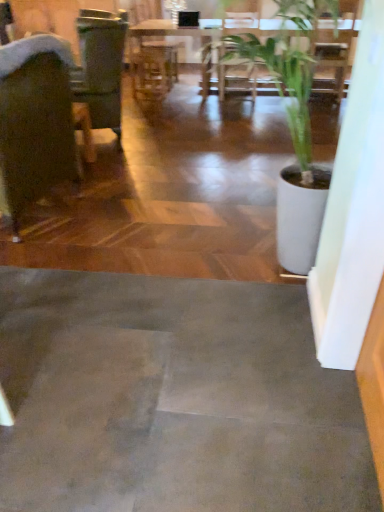
Where is `green leafy plant at upper center`? This screenshot has height=512, width=384. green leafy plant at upper center is located at coordinates (333, 57).

This screenshot has height=512, width=384. What do you see at coordinates (333, 57) in the screenshot? I see `green leafy plant at upper center` at bounding box center [333, 57].

What is the approximate height of dark brown leather chair at left?

3.51 feet.

What are the coordinates of `dark brown leather chair at left` in the screenshot? It's located at (35, 122).

Measure the distance between point [27,39] and camera.

A distance of 6.73 feet exists between point [27,39] and camera.

What do you see at coordinates (35, 122) in the screenshot? I see `dark brown leather chair at left` at bounding box center [35, 122].

Where is `green leafy plant at upper center`? The width and height of the screenshot is (384, 512). green leafy plant at upper center is located at coordinates (333, 57).

Considering the positions of objects green leafy plant at upper center and dark brown leather chair at left in the image provided, who is more to the left, green leafy plant at upper center or dark brown leather chair at left?

Positioned to the left is dark brown leather chair at left.

Consider the image. Which is behind, green leafy plant at upper center or dark brown leather chair at left?

green leafy plant at upper center.

Is point (342, 46) positioned after point (14, 119)?

Yes, point (342, 46) is farther from viewer.

From the image's perspective, is green leafy plant at upper center located above or below dark brown leather chair at left?

Based on their image positions, green leafy plant at upper center is located above dark brown leather chair at left.

From a real-world perspective, who is located higher, green leafy plant at upper center or dark brown leather chair at left?

dark brown leather chair at left.

Considering the relative sizes of green leafy plant at upper center and dark brown leather chair at left in the image provided, is green leafy plant at upper center wider than dark brown leather chair at left?

Correct, the width of green leafy plant at upper center exceeds that of dark brown leather chair at left.

Based on the photo, who is shorter, green leafy plant at upper center or dark brown leather chair at left?

green leafy plant at upper center.

In terms of size, does green leafy plant at upper center appear bigger or smaller than dark brown leather chair at left?

Considering their sizes, green leafy plant at upper center takes up more space than dark brown leather chair at left.

Is green leafy plant at upper center not within dark brown leather chair at left?

That's correct, green leafy plant at upper center is outside of dark brown leather chair at left.

Is green leafy plant at upper center far away from dark brown leather chair at left?

Absolutely, green leafy plant at upper center is distant from dark brown leather chair at left.

Could you tell me if green leafy plant at upper center is turned towards dark brown leather chair at left?

Yes, green leafy plant at upper center is aimed at dark brown leather chair at left.

How different are the orientations of green leafy plant at upper center and dark brown leather chair at left in degrees?

104 degrees separate the facing orientations of green leafy plant at upper center and dark brown leather chair at left.

I want to click on table that is under the dark brown leather chair at left (from a real-world perspective), so click(x=333, y=57).

Which is more to the right, dark brown leather chair at left or green leafy plant at upper center?

green leafy plant at upper center.

Is dark brown leather chair at left further to camera compared to green leafy plant at upper center?

That is False.

Is point (5, 54) positioned in front of point (149, 22)?

Yes, it is in front of point (149, 22).

From the image's perspective, which object appears higher, dark brown leather chair at left or green leafy plant at upper center?

green leafy plant at upper center appears higher in the image.

Based on the photo, from a real-world perspective, which object rests below the other?

green leafy plant at upper center is physically lower.

Is dark brown leather chair at left thinner than green leafy plant at upper center?

Indeed, dark brown leather chair at left has a lesser width compared to green leafy plant at upper center.

Does dark brown leather chair at left have a lesser height compared to green leafy plant at upper center?

No.

Considering the relative sizes of dark brown leather chair at left and green leafy plant at upper center in the image provided, is dark brown leather chair at left bigger than green leafy plant at upper center?

Incorrect, dark brown leather chair at left is not larger than green leafy plant at upper center.

Is green leafy plant at upper center inside dark brown leather chair at left?

Definitely not — green leafy plant at upper center is not inside dark brown leather chair at left.

Are dark brown leather chair at left and green leafy plant at upper center making contact?

No, dark brown leather chair at left is not with green leafy plant at upper center.

In the scene shown: Is dark brown leather chair at left facing towards green leafy plant at upper center?

No, dark brown leather chair at left is not turned towards green leafy plant at upper center.

How different are the orientations of dark brown leather chair at left and green leafy plant at upper center in degrees?

dark brown leather chair at left and green leafy plant at upper center are facing 104 degrees away from each other.

You are a GUI agent. You are given a task and a screenshot of the screen. Output one action in this format:
    pyautogui.click(x=<x>, y=<y>)
    Task: Click on the chair on the left of the green leafy plant at upper center
    The image size is (384, 512).
    Given the screenshot: What is the action you would take?
    pyautogui.click(x=35, y=122)

Locate an element on the screen. chair above the green leafy plant at upper center (from a real-world perspective) is located at coordinates (35, 122).

The height and width of the screenshot is (512, 384). Find the location of `chair to the left of green leafy plant at upper center`. chair to the left of green leafy plant at upper center is located at coordinates (35, 122).